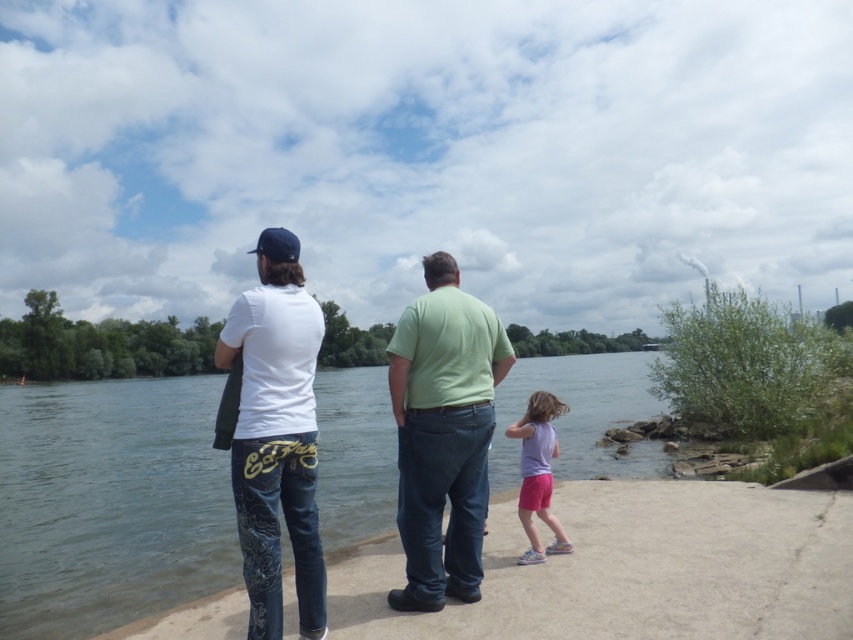
Which of these two, smooth concrete shoreline at lower center or green matte shirt at center, stands taller?

green matte shirt at center is taller.

Is smooth concrete shoreline at lower center shorter than green matte shirt at center?

Yes, smooth concrete shoreline at lower center is shorter than green matte shirt at center.

Is point (833, 538) behind point (398, 524)?

Yes, it is.

I want to click on smooth concrete shoreline at lower center, so click(635, 570).

Can you confirm if white cotton shirt at center is thinner than green matte shirt at center?

No.

Locate an element on the screen. white cotton shirt at center is located at coordinates (274, 435).

The width and height of the screenshot is (853, 640). Find the location of `smooth concrete shoreline at lower center`. smooth concrete shoreline at lower center is located at coordinates (635, 570).

Between smooth concrete shoreline at lower center and purple cotton shirt at lower right, which one appears on the right side from the viewer's perspective?

Positioned to the right is smooth concrete shoreline at lower center.

Find the location of `smooth concrete shoreline at lower center`. smooth concrete shoreline at lower center is located at coordinates (635, 570).

The height and width of the screenshot is (640, 853). In order to click on smooth concrete shoreline at lower center in this screenshot , I will do `click(635, 570)`.